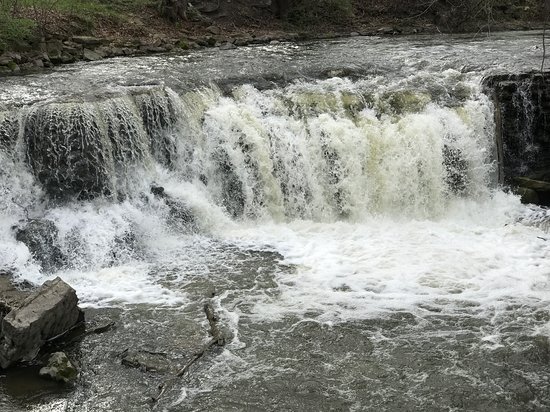
Where is `green plants top left`? The height and width of the screenshot is (412, 550). green plants top left is located at coordinates (10, 30), (45, 20), (70, 11), (93, 7), (25, 5).